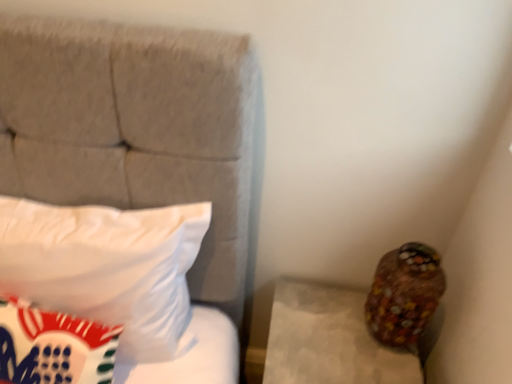
Question: In terms of height, does multicolored glass vase at lower right look taller or shorter compared to white soft pillow at left?

Choices:
 (A) short
 (B) tall

Answer: (A)

Question: Visually, is multicolored glass vase at lower right positioned to the left or to the right of white soft pillow at left?

Choices:
 (A) right
 (B) left

Answer: (A)

Question: From the image's perspective, is multicolored glass vase at lower right located above or below white soft pillow at left?

Choices:
 (A) above
 (B) below

Answer: (B)

Question: Is white soft pillow at left bigger or smaller than multicolored glass vase at lower right?

Choices:
 (A) big
 (B) small

Answer: (A)

Question: In the image, is white soft pillow at left on the left side or the right side of multicolored glass vase at lower right?

Choices:
 (A) right
 (B) left

Answer: (B)

Question: Is white soft pillow at left wider or thinner than multicolored glass vase at lower right?

Choices:
 (A) wide
 (B) thin

Answer: (A)

Question: From a real-world perspective, is white soft pillow at left physically located above or below multicolored glass vase at lower right?

Choices:
 (A) above
 (B) below

Answer: (A)